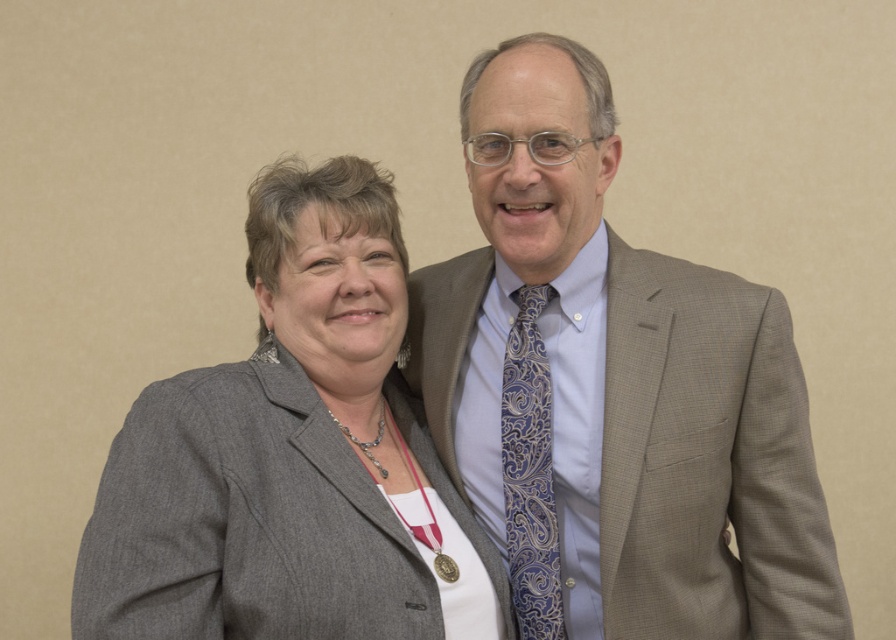
Can you confirm if gray textured suit at center is positioned to the right of blue paisley tie at center?

Indeed, gray textured suit at center is positioned on the right side of blue paisley tie at center.

Is gray textured suit at center positioned in front of blue paisley tie at center?

Yes, it is.

The image size is (896, 640). In order to click on gray textured suit at center in this screenshot , I will do `click(613, 388)`.

Can you confirm if gray wool blazer at center is taller than blue paisley tie at center?

Yes.

Is gray wool blazer at center thinner than blue paisley tie at center?

Incorrect, gray wool blazer at center's width is not less than blue paisley tie at center's.

Is point (114, 454) farther from camera compared to point (536, 552)?

No, (114, 454) is in front of (536, 552).

At what (x,y) coordinates should I click in order to perform the action: click on gray wool blazer at center. Please return your answer as a coordinate pair (x, y). Looking at the image, I should click on tap(291, 456).

Does gray textured suit at center have a lesser width compared to gray wool blazer at center?

No.

Does gray textured suit at center appear on the right side of gray wool blazer at center?

Yes, gray textured suit at center is to the right of gray wool blazer at center.

Does point (455, 435) lie behind point (170, 577)?

Yes, point (455, 435) is behind point (170, 577).

This screenshot has height=640, width=896. Find the location of `gray textured suit at center`. gray textured suit at center is located at coordinates (613, 388).